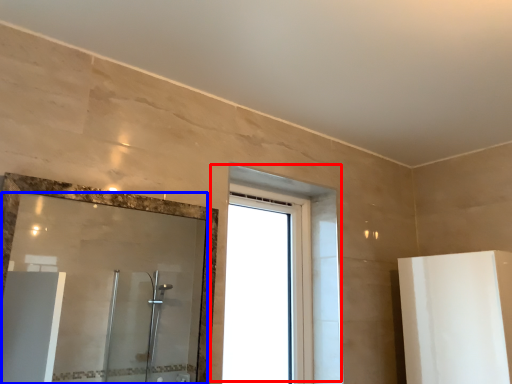
Question: Which object is further to the camera taking this photo, window (highlighted by a red box) or mirror (highlighted by a blue box)?

Choices:
 (A) window
 (B) mirror

Answer: (A)